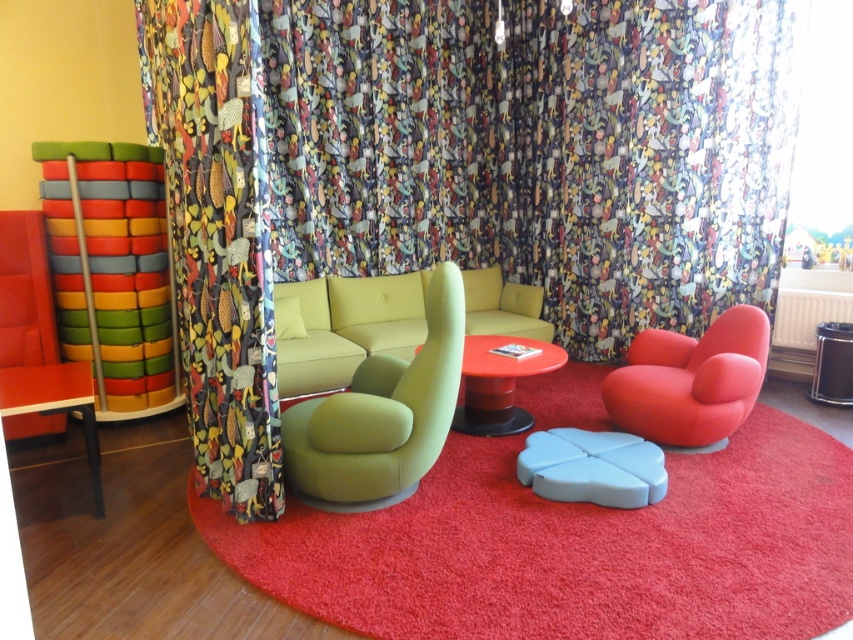
Does matte green swivel chair at center have a lesser width compared to matte red swivel chair at lower right?

Correct, matte green swivel chair at center's width is less than matte red swivel chair at lower right's.

What do you see at coordinates (381, 416) in the screenshot?
I see `matte green swivel chair at center` at bounding box center [381, 416].

Where is `matte green swivel chair at center`? Image resolution: width=853 pixels, height=640 pixels. matte green swivel chair at center is located at coordinates (381, 416).

Consider the image. Does floral fabric curtain at center appear under matte green swivel chair at center?

Actually, floral fabric curtain at center is above matte green swivel chair at center.

Where is `floral fabric curtain at center`? Image resolution: width=853 pixels, height=640 pixels. floral fabric curtain at center is located at coordinates (534, 148).

This screenshot has height=640, width=853. In order to click on floral fabric curtain at center in this screenshot , I will do `click(534, 148)`.

Consider the image. Between matte red swivel chair at lower right and light blue plastic stool at center, which one has more height?

matte red swivel chair at lower right

Does matte red swivel chair at lower right have a greater height compared to light blue plastic stool at center?

Correct, matte red swivel chair at lower right is much taller as light blue plastic stool at center.

Where is `matte red swivel chair at lower right`? The height and width of the screenshot is (640, 853). matte red swivel chair at lower right is located at coordinates (689, 380).